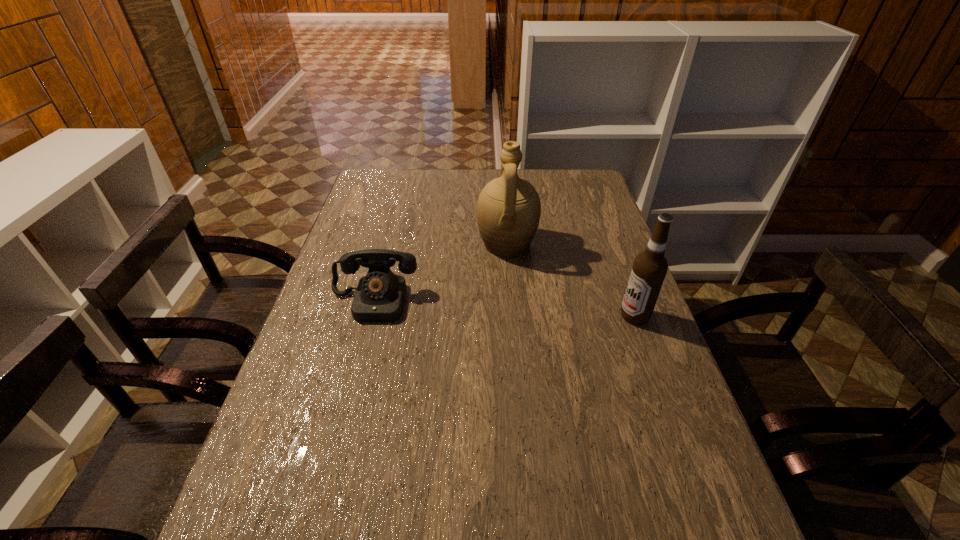
What are the coordinates of `object that is at the left edge` in the screenshot? It's located at (379, 297).

Where is `object situated at the right edge`? This screenshot has height=540, width=960. object situated at the right edge is located at coordinates (649, 269).

Find the location of `vacant space at the far edge`. vacant space at the far edge is located at coordinates (530, 178).

Where is `vacant area at the left edge`? vacant area at the left edge is located at coordinates (341, 280).

Locate an element on the screen. This screenshot has height=540, width=960. free region at the right edge of the desktop is located at coordinates coord(589,291).

This screenshot has width=960, height=540. Identify the location of free region at the far left corner of the desktop. (380, 173).

Locate an element on the screen. This screenshot has height=540, width=960. free area in between the leftmost object and the rightmost object is located at coordinates (504, 309).

Find the location of a particular element. free point between the leftmost object and the alcohol is located at coordinates (504, 309).

Where is `vacant space in between the telephone and the alcohol`? The width and height of the screenshot is (960, 540). vacant space in between the telephone and the alcohol is located at coordinates (504, 309).

Choose which object is the second nearest neighbor to the second object from left to right. Please provide its 2D coordinates. Your answer should be formatted as a tuple, i.e. [(x, y)], where the tuple contains the x and y coordinates of a point satisfying the conditions above.

[(649, 269)]